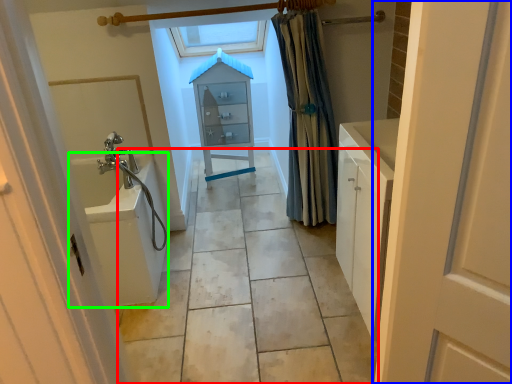
Question: Considering the real-world distances, which object is closest to path (highlighted by a red box)? door (highlighted by a blue box) or bath (highlighted by a green box).

Choices:
 (A) door
 (B) bath

Answer: (B)